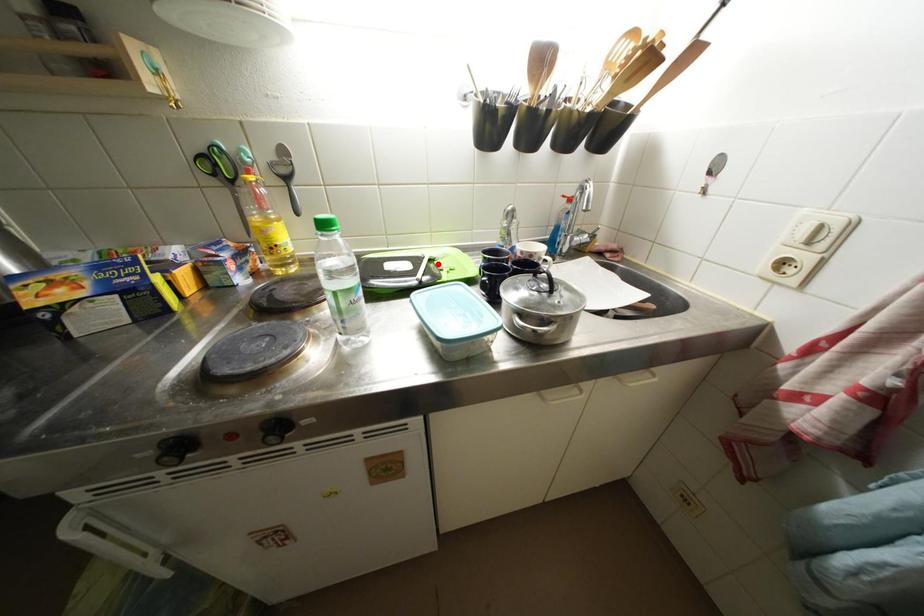
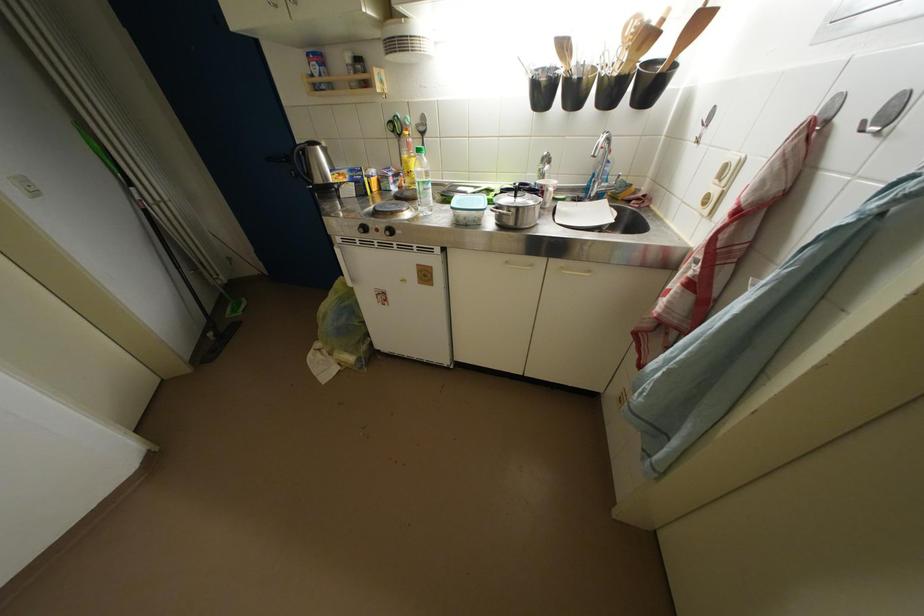
Question: I am providing you with two images of the same scene from different viewpoints. A red point is marked on the first image. At the location where the point appears in image 1, is it still visible in image 2?

Choices:
 (A) Yes
 (B) No

Answer: (A)